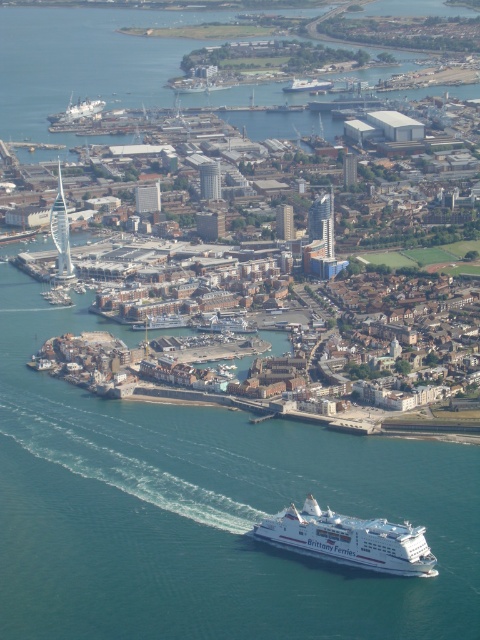
Question: Is white matte ferry at lower center above white glossy ferry at center?

Choices:
 (A) yes
 (B) no

Answer: (B)

Question: Is white matte ferry at lower center above white glossy ferry at center?

Choices:
 (A) no
 (B) yes

Answer: (A)

Question: Which object appears closest to the camera in this image?

Choices:
 (A) white matte ferry at lower center
 (B) white glossy ferry at center

Answer: (A)

Question: Among these points, which one is nearest to the camera?

Choices:
 (A) (409, 545)
 (B) (325, 83)

Answer: (B)

Question: Which point is farther from the camera taking this photo?

Choices:
 (A) pos(405,564)
 (B) pos(326,83)

Answer: (A)

Question: Is white matte ferry at lower center to the left of white glossy ferry at center from the viewer's perspective?

Choices:
 (A) no
 (B) yes

Answer: (A)